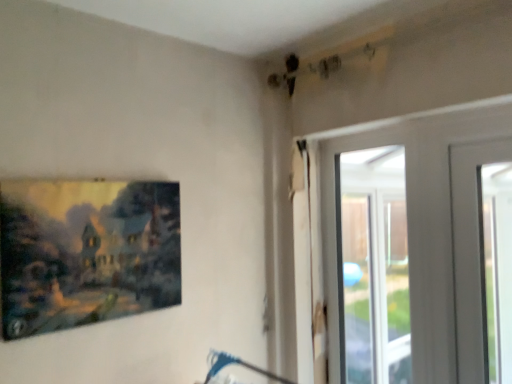
Locate an element on the screen. Image resolution: width=512 pixels, height=384 pixels. matte canvas painting at left is located at coordinates (86, 252).

What do you see at coordinates (86, 252) in the screenshot? I see `matte canvas painting at left` at bounding box center [86, 252].

Measure the distance between point [351,343] and camera.

6.51 feet.

The width and height of the screenshot is (512, 384). What do you see at coordinates (374, 267) in the screenshot?
I see `transparent glass door at upper right` at bounding box center [374, 267].

The height and width of the screenshot is (384, 512). Find the location of `transparent glass door at upper right`. transparent glass door at upper right is located at coordinates (374, 267).

I want to click on matte canvas painting at left, so click(x=86, y=252).

Considering the relative positions of transparent glass door at upper right and matte canvas painting at left in the image provided, is transparent glass door at upper right to the left of matte canvas painting at left from the viewer's perspective?

No.

Is transparent glass door at upper right positioned before matte canvas painting at left?

No, it is behind matte canvas painting at left.

Which is further, (404, 369) or (82, 199)?

The point (404, 369) is behind.

Based on the photo, from the image's perspective, is transparent glass door at upper right located beneath matte canvas painting at left?

Indeed, from the image's perspective, transparent glass door at upper right is shown beneath matte canvas painting at left.

From a real-world perspective, which object stands above the other?

matte canvas painting at left is physically above.

Considering the relative sizes of transparent glass door at upper right and matte canvas painting at left in the image provided, is transparent glass door at upper right thinner than matte canvas painting at left?

Yes.

Who is taller, transparent glass door at upper right or matte canvas painting at left?

transparent glass door at upper right is taller.

Is transparent glass door at upper right smaller than matte canvas painting at left?

No, transparent glass door at upper right is not smaller than matte canvas painting at left.

Is transparent glass door at upper right not within matte canvas painting at left?

→ Indeed, transparent glass door at upper right is completely outside matte canvas painting at left.

Would you consider transparent glass door at upper right to be distant from matte canvas painting at left?

Yes.

Consider the image. Does transparent glass door at upper right turn towards matte canvas painting at left?

Yes, transparent glass door at upper right faces towards matte canvas painting at left.

How many degrees apart are the facing directions of transparent glass door at upper right and matte canvas painting at left?

The angular difference between transparent glass door at upper right and matte canvas painting at left is 89.1 degrees.

Locate an element on the screen. Image resolution: width=512 pixels, height=384 pixels. picture frame that is above the transparent glass door at upper right (from a real-world perspective) is located at coordinates (86, 252).

Is matte canvas painting at left to the right of transparent glass door at upper right from the viewer's perspective?

No.

Considering the relative positions of matte canvas painting at left and transparent glass door at upper right in the image provided, is matte canvas painting at left in front of transparent glass door at upper right?

Yes, matte canvas painting at left is closer to the camera.

Does point (71, 250) come farther from viewer compared to point (398, 155)?

No, (71, 250) is in front of (398, 155).

From the image's perspective, who appears lower, matte canvas painting at left or transparent glass door at upper right?

transparent glass door at upper right.

From a real-world perspective, is matte canvas painting at left physically located above or below transparent glass door at upper right?

From a real-world perspective, matte canvas painting at left is physically above transparent glass door at upper right.

Considering the sizes of objects matte canvas painting at left and transparent glass door at upper right in the image provided, who is thinner, matte canvas painting at left or transparent glass door at upper right?

With smaller width is transparent glass door at upper right.

Who is shorter, matte canvas painting at left or transparent glass door at upper right?

matte canvas painting at left is shorter.

Which of these two, matte canvas painting at left or transparent glass door at upper right, is bigger?

transparent glass door at upper right is bigger.

Is matte canvas painting at left situated inside transparent glass door at upper right or outside?

matte canvas painting at left is spatially situated outside transparent glass door at upper right.

Are matte canvas painting at left and transparent glass door at upper right far apart?

Yes.

Is matte canvas painting at left facing towards transparent glass door at upper right?

No.

Where is `window below the matte canvas painting at left (from a real-world perspective)`? Image resolution: width=512 pixels, height=384 pixels. window below the matte canvas painting at left (from a real-world perspective) is located at coordinates (374, 267).

Where is `window below the matte canvas painting at left (from the image's perspective)`? window below the matte canvas painting at left (from the image's perspective) is located at coordinates (374, 267).

Where is `window behind the matte canvas painting at left`? Image resolution: width=512 pixels, height=384 pixels. window behind the matte canvas painting at left is located at coordinates (374, 267).